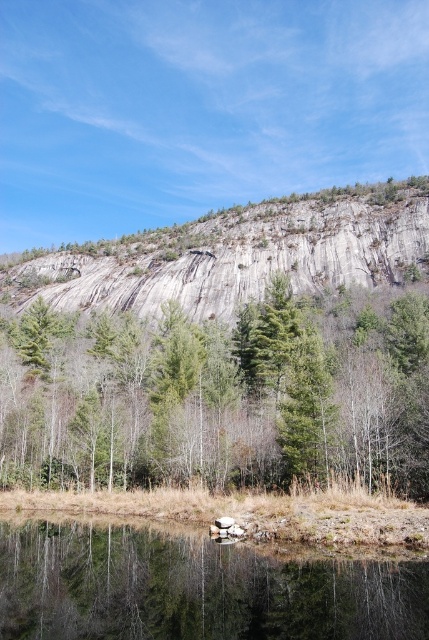
You are a hiker who wants to cross from the green textured tree at center to the clear water at bottom. The path you plan to take is 30 meters long. Is this path long enough to reach the water?

The distance between the green textured tree at center and the clear water at bottom is 40.31 meters, so a 30 meter path would not be long enough to reach the water.

You are planning to take a photo of the gray rock cliff at upper center and the green textured tree at center. Which object should you focus on first if you want to capture both in a single frame without moving the camera?

You should focus on the gray rock cliff at upper center first because it is larger than the green textured tree at center, ensuring it is sharp in the frame.